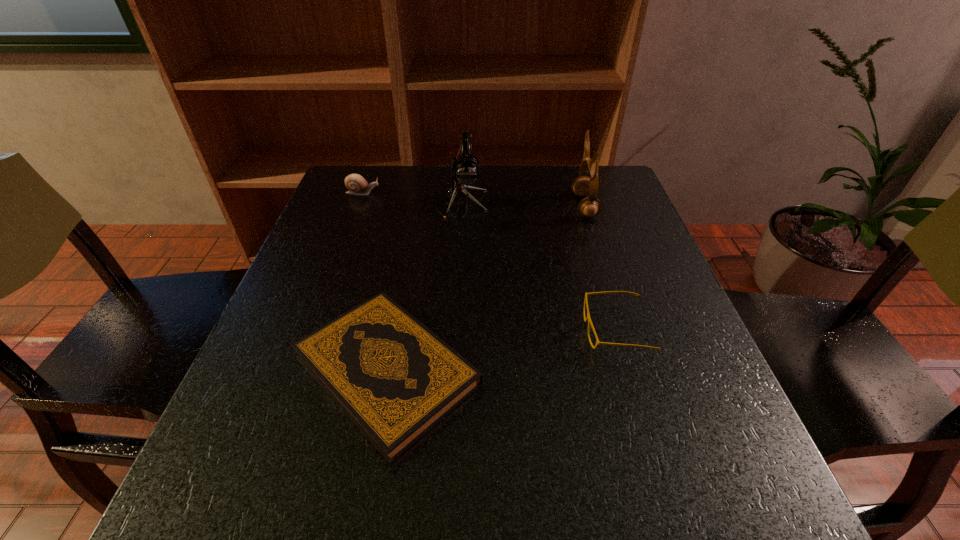
The image size is (960, 540). Find the location of `the left earphone`. the left earphone is located at coordinates (465, 169).

What are the coordinates of `the right earphone` in the screenshot? It's located at (589, 207).

Locate an element on the screen. the third shortest object is located at coordinates 355,183.

You are a GUI agent. You are given a task and a screenshot of the screen. Output one action in this format:
    pyautogui.click(x=<x>, y=<y>)
    Task: Click on the spectacles
    
    Given the screenshot: What is the action you would take?
    pyautogui.click(x=588, y=318)

The width and height of the screenshot is (960, 540). Identify the location of the shortest object. (395, 379).

What are the coordinates of `free space located on the back of the left earphone` in the screenshot? It's located at (464, 180).

Find the location of `vacant space located 0.130m on the front-facing side of the right earphone`. vacant space located 0.130m on the front-facing side of the right earphone is located at coordinates pyautogui.click(x=523, y=206).

Identify the location of vacant area located 0.310m on the front-facing side of the right earphone. The width and height of the screenshot is (960, 540). (454, 206).

This screenshot has width=960, height=540. I want to click on vacant space located 0.290m on the front-facing side of the right earphone, so click(x=462, y=206).

I want to click on vacant space located on the front-facing side of the escargot, so click(x=445, y=193).